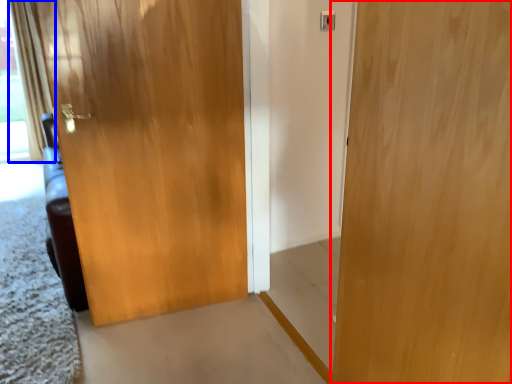
Question: Which point is further to the camera, door (highlighted by a red box) or curtain (highlighted by a blue box)?

Choices:
 (A) door
 (B) curtain

Answer: (B)